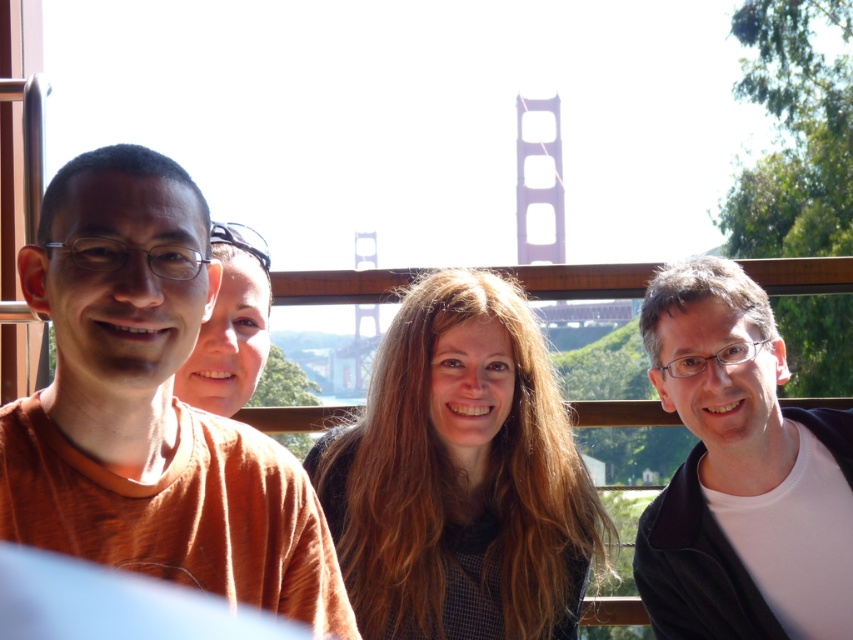
Who is more distant from viewer, (364, 611) or (770, 356)?

The point (770, 356) is more distant.

Which is in front, point (601, 515) or point (675, 481)?

Point (675, 481) is more forward.

Identify the location of dark brown hair at center. (460, 484).

Which is below, orange t-shirt at left or dark brown hair at center?

Positioned lower is dark brown hair at center.

Does orange t-shirt at left have a lesser height compared to dark brown hair at center?

Incorrect, orange t-shirt at left's height does not fall short of dark brown hair at center's.

Looking at this image, measure the distance between orange t-shirt at left and camera.

They are 74.06 meters apart.

Image resolution: width=853 pixels, height=640 pixels. I want to click on orange t-shirt at left, so click(x=149, y=406).

Which is more to the left, white matte shirt at right or smooth skin face at center?

Positioned to the left is smooth skin face at center.

Does white matte shirt at right appear under smooth skin face at center?

Yes.

Locate an element on the screen. white matte shirt at right is located at coordinates (740, 474).